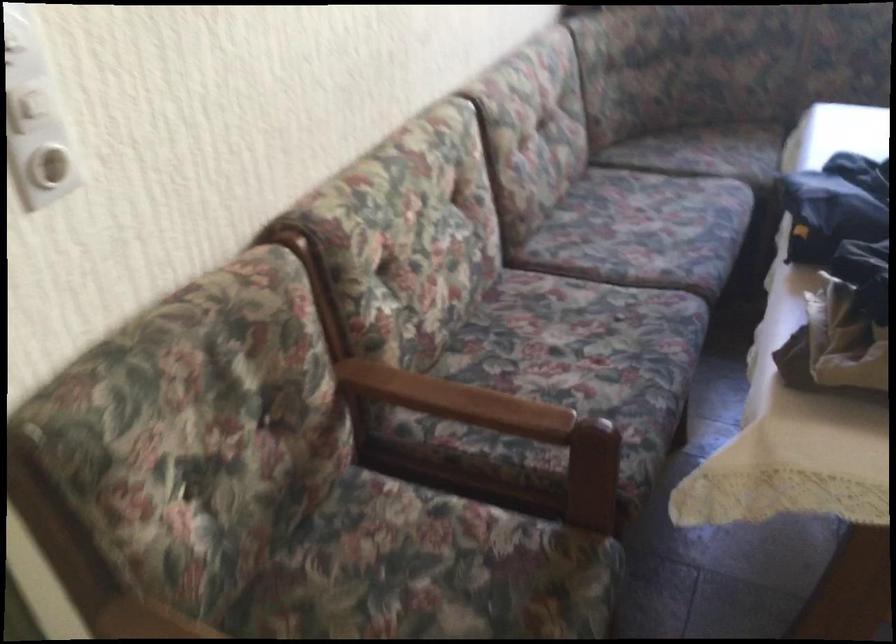
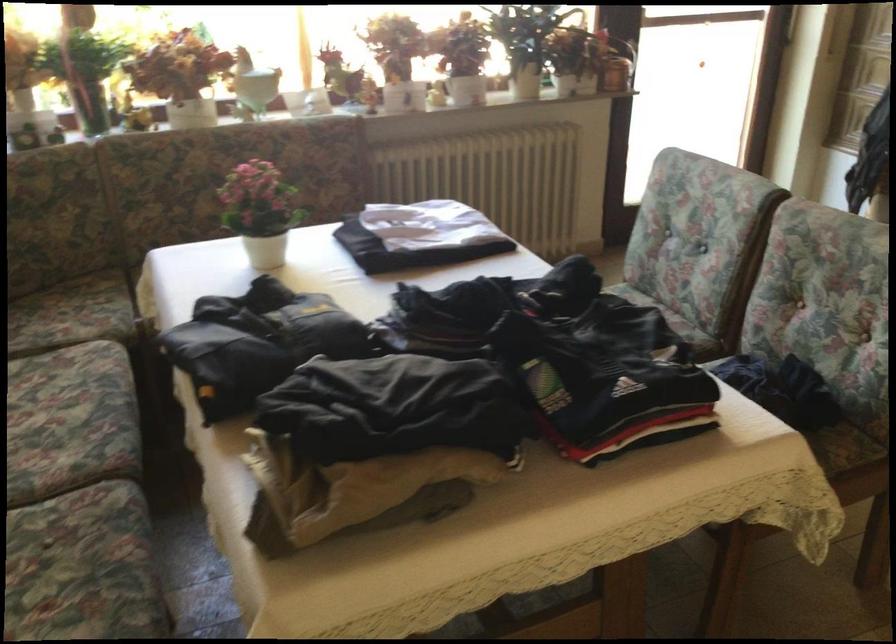
Question: The camera is either moving clockwise (left) or counter-clockwise (right) around the object. The first image is from the beginning of the video and the second image is from the end. Is the camera moving left or right when shooting the video?

Choices:
 (A) Left
 (B) Right

Answer: (A)